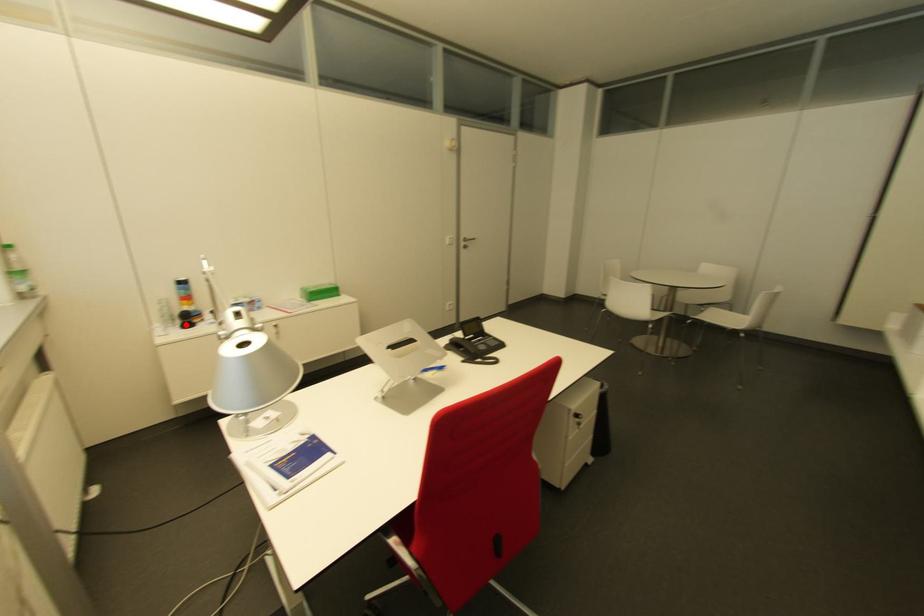
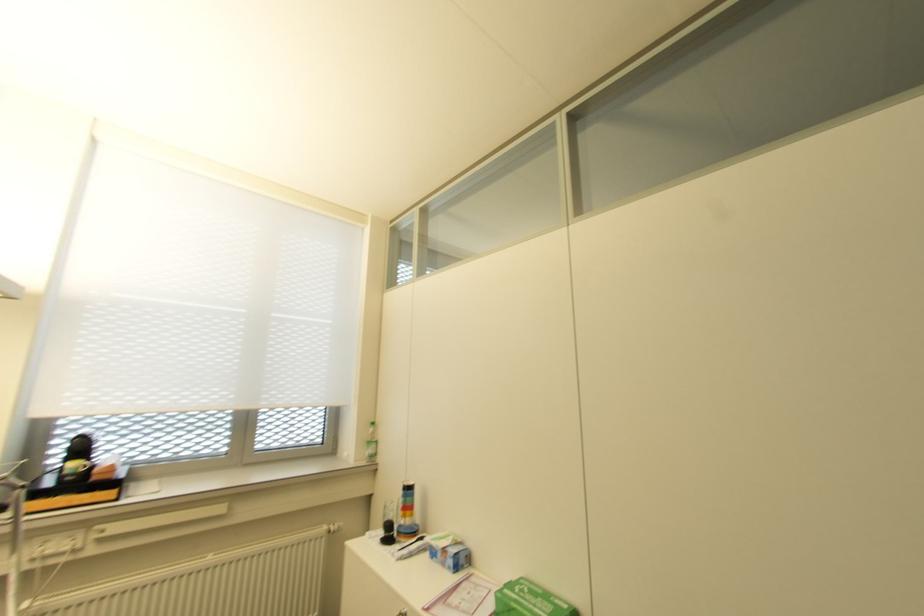
Where in the second image is the point corresponding to the highlighted location from the first image?

(385, 540)